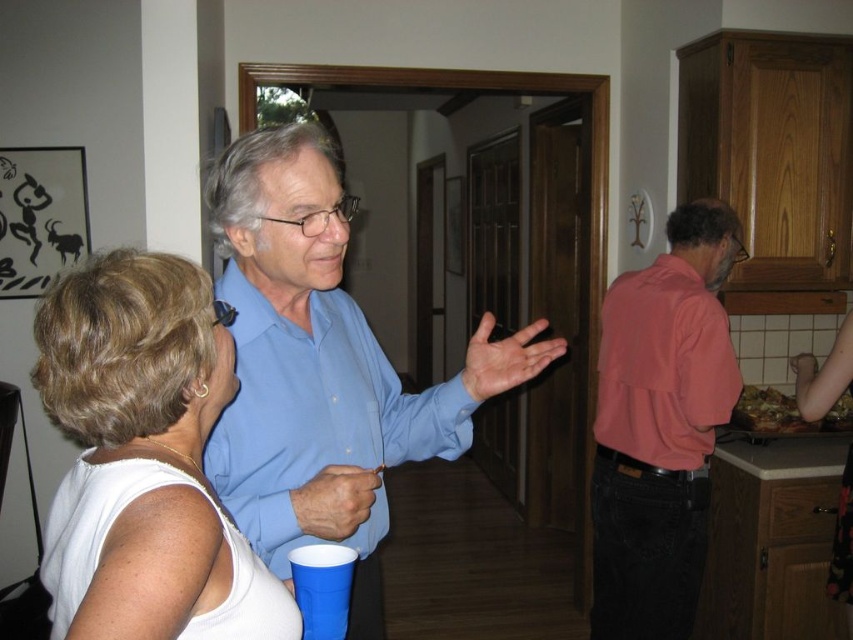
Is point (360, 362) behind point (337, 561)?

Yes, it is.

Does blue smooth shirt at center appear on the left side of blue plastic cup at lower center?

Incorrect, blue smooth shirt at center is not on the left side of blue plastic cup at lower center.

Between point (381, 493) and point (345, 552), which one is positioned behind?

The point (381, 493) is behind.

The height and width of the screenshot is (640, 853). What are the coordinates of `blue smooth shirt at center` in the screenshot? It's located at (323, 368).

Is white matte tank top at upper left closer to the viewer compared to pink matte shirt at right?

Yes, it is in front of pink matte shirt at right.

Who is positioned more to the right, white matte tank top at upper left or pink matte shirt at right?

From the viewer's perspective, pink matte shirt at right appears more on the right side.

What do you see at coordinates (144, 460) in the screenshot? The image size is (853, 640). I see `white matte tank top at upper left` at bounding box center [144, 460].

Locate an element on the screen. This screenshot has height=640, width=853. white matte tank top at upper left is located at coordinates (144, 460).

Is blue smooth shirt at center wider than pink matte shirt at right?

Yes.

Describe the element at coordinates (323, 368) in the screenshot. I see `blue smooth shirt at center` at that location.

I want to click on blue smooth shirt at center, so click(323, 368).